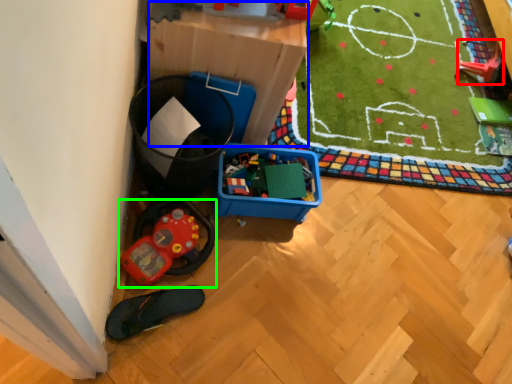
Question: Considering the real-world distances, which object is farthest from toy (highlighted by a red box)? storage box (highlighted by a blue box) or toy (highlighted by a green box)?

Choices:
 (A) storage box
 (B) toy

Answer: (B)